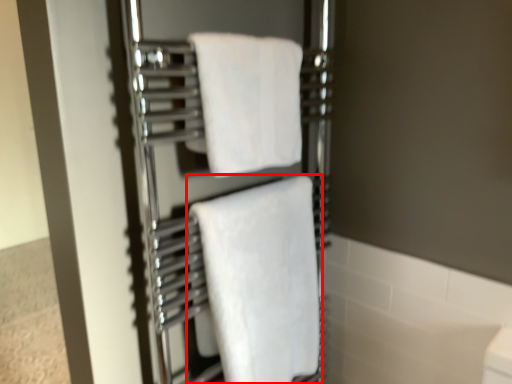
Question: From the image's perspective, where is towel (annotated by the red box) located in relation to towel in the image?

Choices:
 (A) below
 (B) above

Answer: (A)